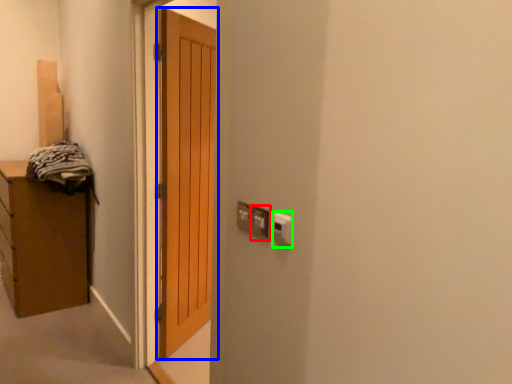
Question: Which object is positioned closest to electric outlet (highlighted by a red box)? Select from door (highlighted by a blue box) and electric outlet (highlighted by a green box).

Choices:
 (A) door
 (B) electric outlet

Answer: (B)